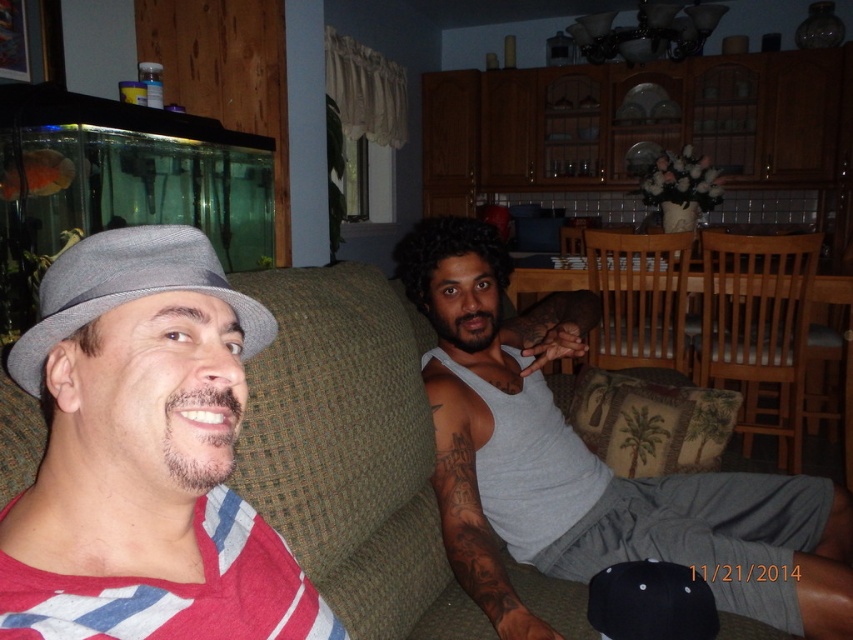
Does gray fabric hat at upper left appear under goldfish at left?

Yes.

Between gray fabric hat at upper left and goldfish at left, which one appears on the right side from the viewer's perspective?

Positioned to the right is gray fabric hat at upper left.

Is point (111, 472) more distant than point (10, 177)?

No, it is not.

This screenshot has height=640, width=853. I want to click on gray fabric hat at upper left, so click(x=144, y=456).

Can you confirm if gray fabric hat at upper left is shorter than black matte baseball cap at lower center?

No.

Is gray fabric hat at upper left taller than black matte baseball cap at lower center?

Yes, gray fabric hat at upper left is taller than black matte baseball cap at lower center.

Locate an element on the screen. The height and width of the screenshot is (640, 853). gray fabric hat at upper left is located at coordinates (144, 456).

Image resolution: width=853 pixels, height=640 pixels. I want to click on gray fabric hat at upper left, so click(144, 456).

Who is lower down, gray matte tank top at center or black matte baseball cap at lower center?

Positioned lower is black matte baseball cap at lower center.

Does gray matte tank top at center have a greater height compared to black matte baseball cap at lower center?

Yes, gray matte tank top at center is taller than black matte baseball cap at lower center.

Is point (469, 588) in front of point (679, 637)?

No.

Where is `gray matte tank top at center`? The image size is (853, 640). gray matte tank top at center is located at coordinates point(471,506).